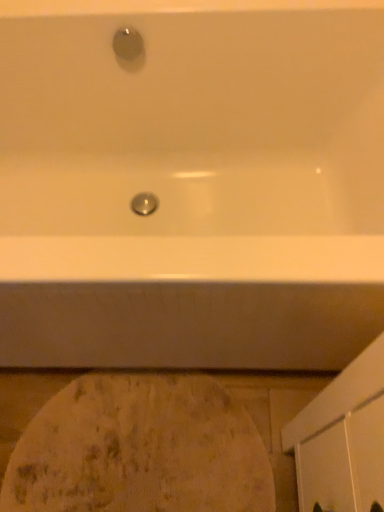
Locate an element on the screen. The image size is (384, 512). free space above white textured rug at lower center (from a real-world perspective) is located at coordinates (139, 440).